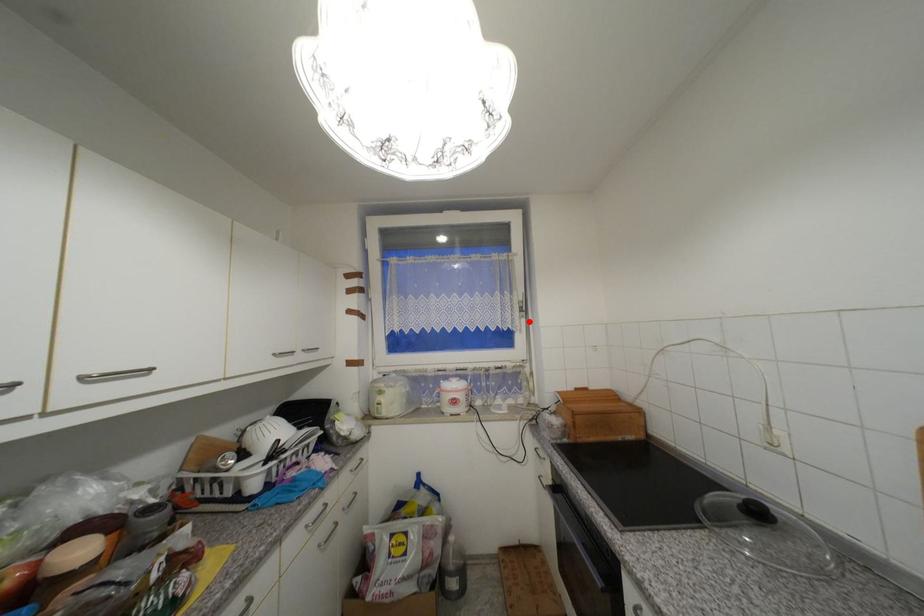
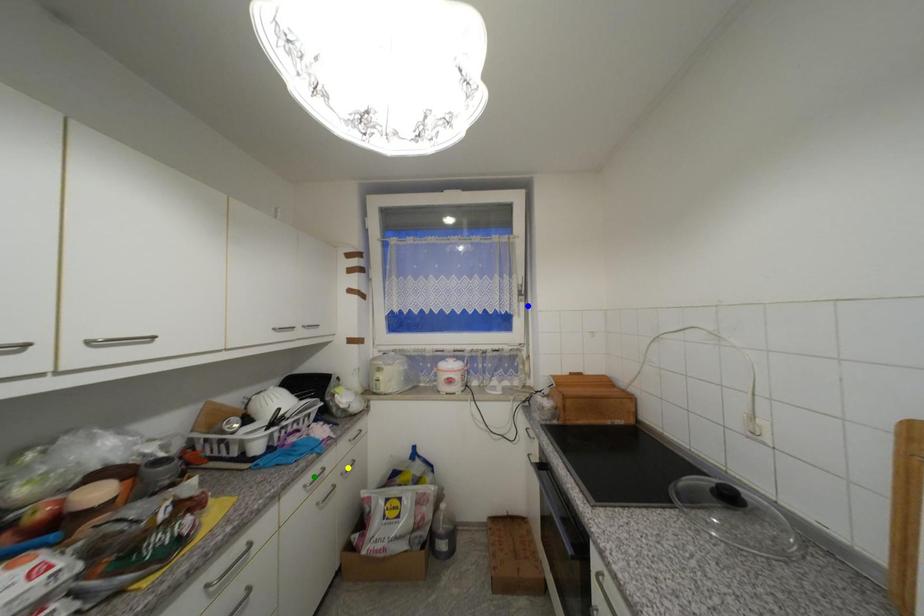
Question: I am providing you with two images of the same scene from different viewpoints. A red point is marked on the first image. You are given multiple points on the second image. Can you choose the point in image 2 that corresponds to the point in image 1?

Choices:
 (A) blue point
 (B) green point
 (C) yellow point

Answer: (A)